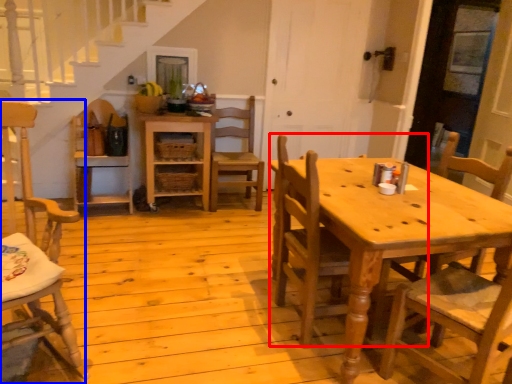
Question: Which object appears closest to the camera in this image, chair (highlighted by a red box) or chair (highlighted by a blue box)?

Choices:
 (A) chair
 (B) chair

Answer: (B)